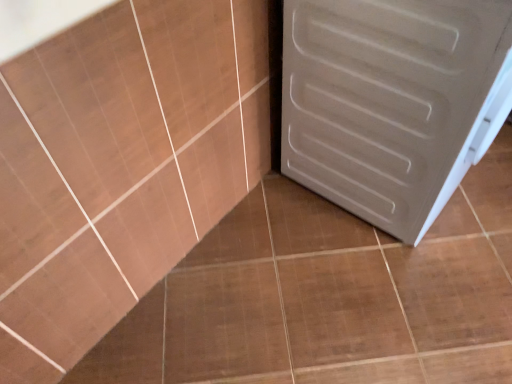
The image size is (512, 384). Identify the location of white matte door at right. (392, 101).

Describe the element at coordinates (392, 101) in the screenshot. This screenshot has width=512, height=384. I see `white matte door at right` at that location.

Where is `white matte door at right`? white matte door at right is located at coordinates (392, 101).